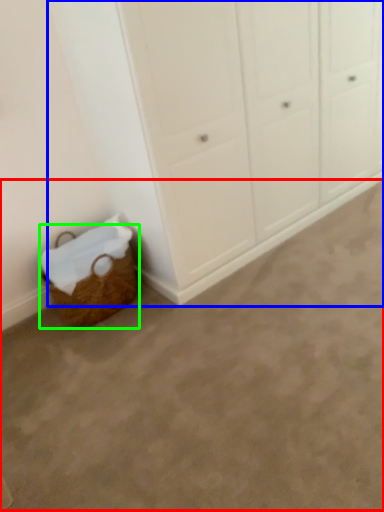
Question: Based on their relative distances, which object is nearer to plain (highlighted by a red box)? Choose from cupboard (highlighted by a blue box) and basket (highlighted by a green box).

Choices:
 (A) cupboard
 (B) basket

Answer: (B)